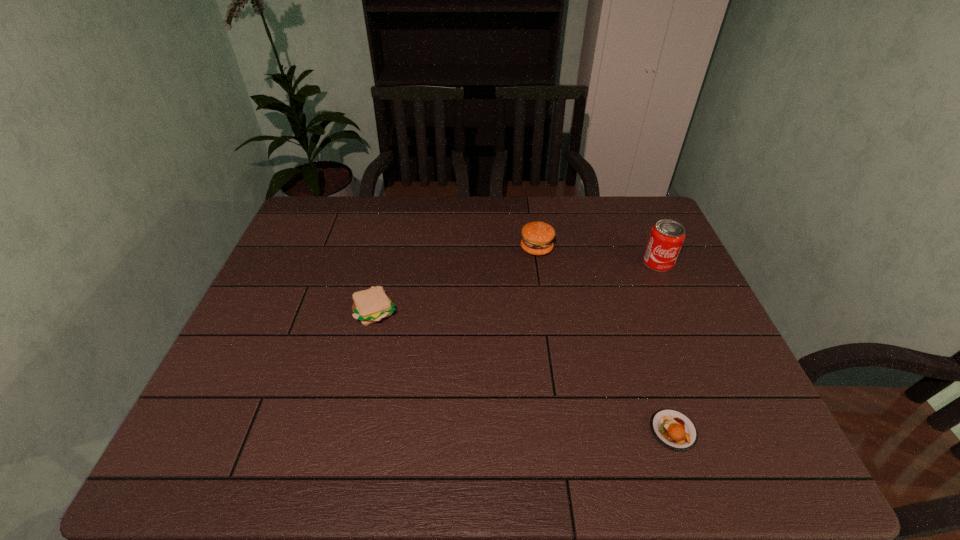
At what (x,y) coordinates should I click in order to perform the action: click on free point located on the left of the third farthest object. Please return your answer as a coordinate pair (x, y). Image resolution: width=960 pixels, height=540 pixels. Looking at the image, I should click on (328, 312).

Where is `vacant space situated on the back of the nearest object`? The image size is (960, 540). vacant space situated on the back of the nearest object is located at coordinates (629, 299).

Where is `object located at the near edge`? The width and height of the screenshot is (960, 540). object located at the near edge is located at coordinates (674, 430).

Locate an element on the screen. The image size is (960, 540). can situated at the right edge is located at coordinates (666, 238).

Where is `patty (food) that is at the right edge`? The height and width of the screenshot is (540, 960). patty (food) that is at the right edge is located at coordinates (674, 430).

You are a GUI agent. You are given a task and a screenshot of the screen. Output one action in this format:
    pyautogui.click(x=<x>, y=<y>)
    Task: Click on the object present at the near right corner
    
    Given the screenshot: What is the action you would take?
    pyautogui.click(x=674, y=430)

Locate an element on the screen. vacant space at the far edge of the desktop is located at coordinates (601, 210).

Where is `free region at the near edge of the desktop`? free region at the near edge of the desktop is located at coordinates (344, 470).

Locate an element on the screen. This screenshot has height=540, width=960. vacant space at the left edge of the desktop is located at coordinates (214, 425).

Find the location of a particular element. This screenshot has width=960, height=540. free space at the right edge of the desktop is located at coordinates (683, 307).